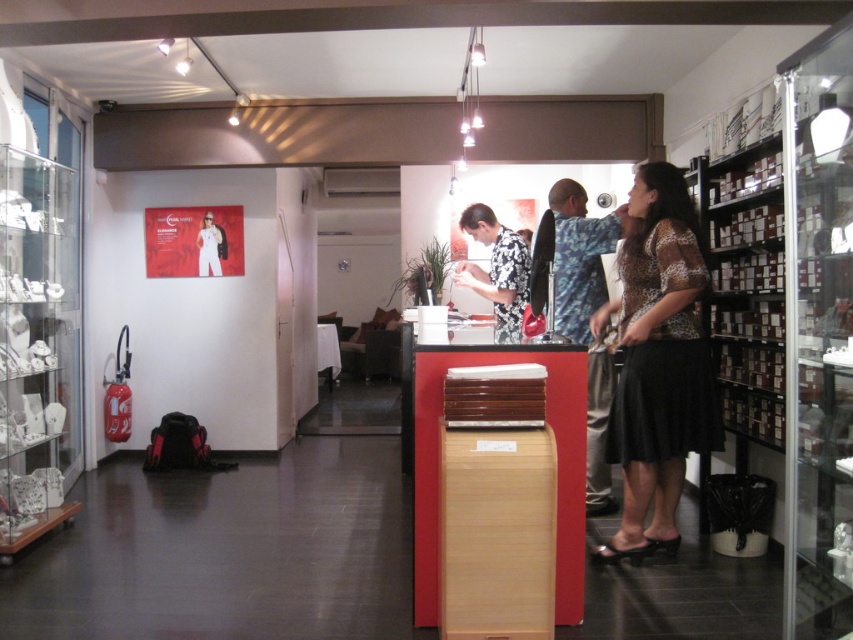
Is leopard print blouse at center shorter than black floral shirt at center?

No.

Is leopard print blouse at center wider than black floral shirt at center?

Yes.

Find the location of `leopard print blouse at center`. leopard print blouse at center is located at coordinates coord(659,362).